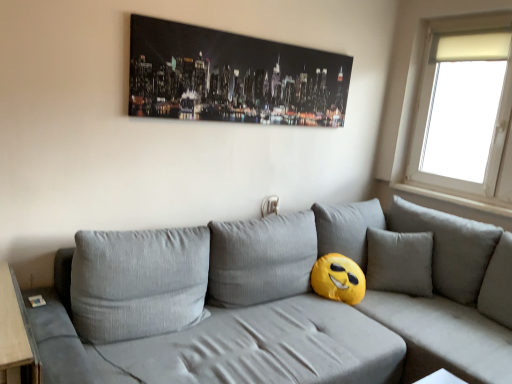
Question: Is point (202, 71) closer or farther from the camera than point (411, 163)?

Choices:
 (A) closer
 (B) farther

Answer: (A)

Question: Would you say black glossy canvas at upper center is inside or outside white frosted glass window at upper right?

Choices:
 (A) inside
 (B) outside

Answer: (B)

Question: Estimate the real-world distances between objects in this image. Which object is farther from the white frosted glass window at upper right?

Choices:
 (A) black glossy canvas at upper center
 (B) textured gray couch at center

Answer: (A)

Question: Estimate the real-world distances between objects in this image. Which object is farther from the black glossy canvas at upper center?

Choices:
 (A) textured gray couch at center
 (B) white frosted glass window at upper right

Answer: (B)